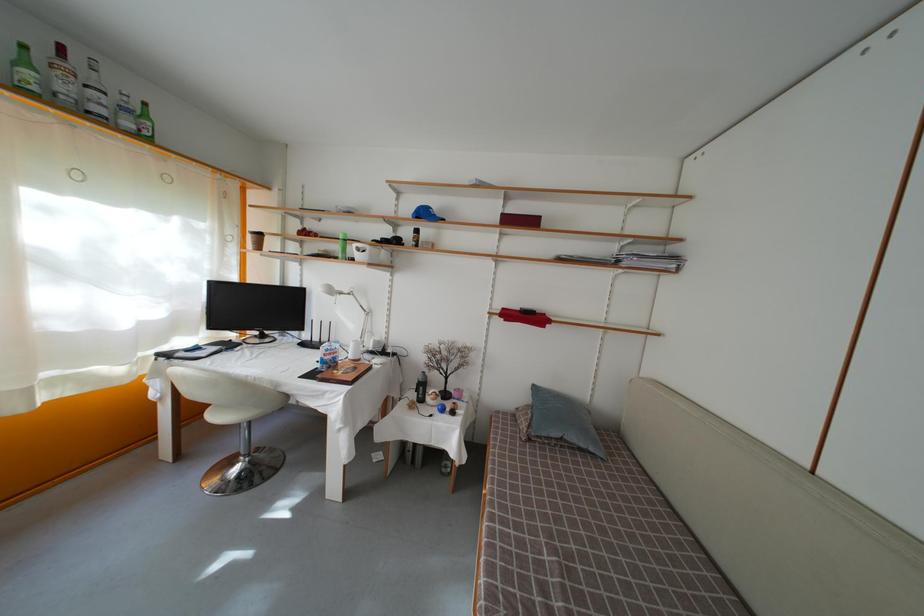
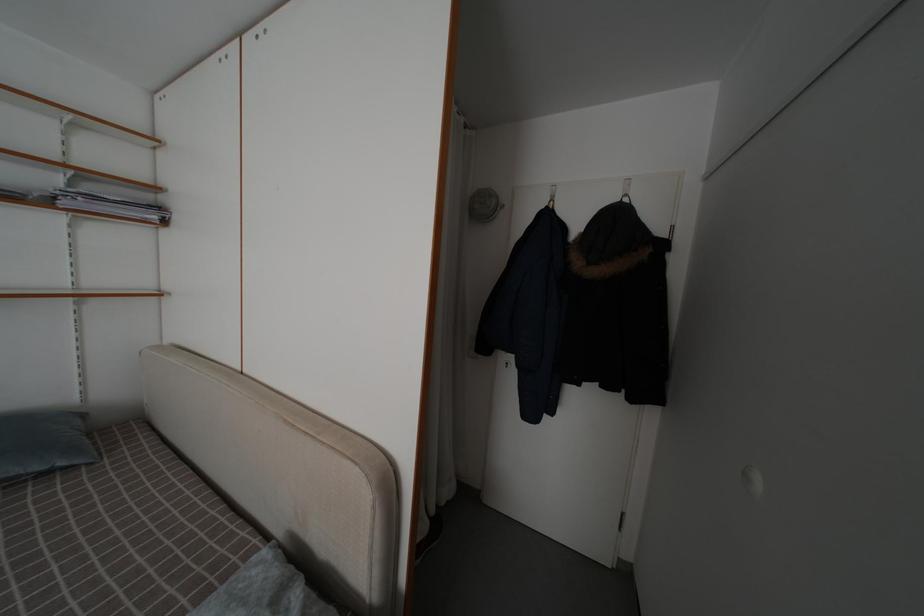
In the second image, find the point that corresponds to [679,273] in the first image.

(161, 224)